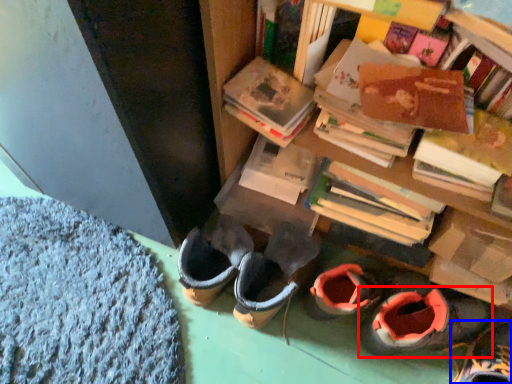
Question: Which object appears closest to the camera in this image, footwear (highlighted by a red box) or footwear (highlighted by a blue box)?

Choices:
 (A) footwear
 (B) footwear

Answer: (B)